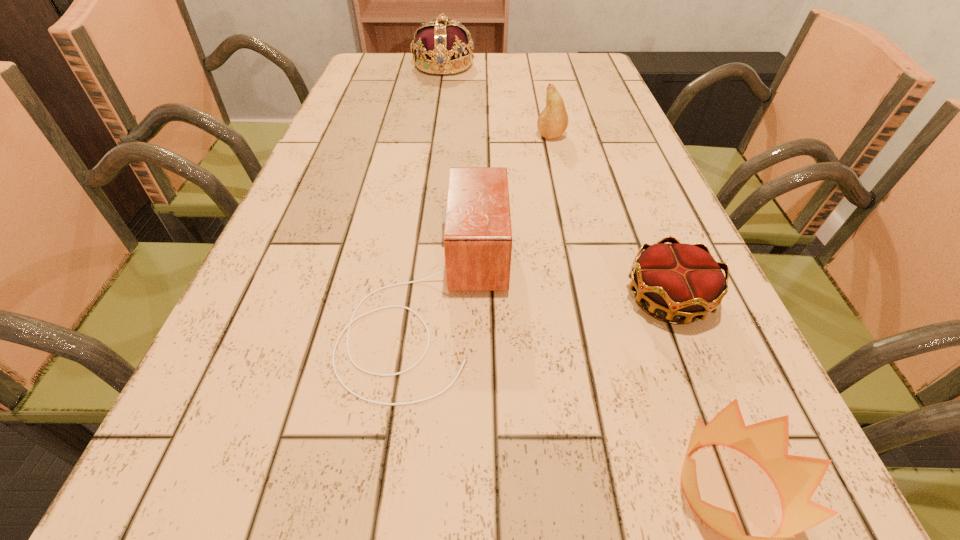
Where is `the farthest crown`? the farthest crown is located at coordinates (440, 46).

Where is `the leftmost crown`? Image resolution: width=960 pixels, height=540 pixels. the leftmost crown is located at coordinates (440, 46).

At what (x,y) coordinates should I click in order to perform the action: click on the fourth nearest object. Please return your answer as a coordinate pair (x, y). The image size is (960, 540). Looking at the image, I should click on 552,122.

Where is `the third object from right to left`? The height and width of the screenshot is (540, 960). the third object from right to left is located at coordinates (552, 122).

At what (x,y) coordinates should I click in order to perform the action: click on radio receiver. Please return your answer as a coordinate pair (x, y). The width and height of the screenshot is (960, 540). Looking at the image, I should click on [476, 222].

Locate an element on the screen. the second farthest crown is located at coordinates (683, 280).

You are a GUI agent. You are given a task and a screenshot of the screen. Output one action in this format:
    pyautogui.click(x=<x>, y=<y>)
    Task: Click on the vacant space located on the front of the tallest crown
    The height and width of the screenshot is (540, 960).
    Given the screenshot: What is the action you would take?
    pyautogui.click(x=437, y=112)

This screenshot has width=960, height=540. What are the coordinates of `vacant point located on the back of the fourth nearest object` in the screenshot? It's located at (538, 76).

This screenshot has width=960, height=540. In order to click on free point located on the front-facing side of the radio receiver in this screenshot , I will do `click(584, 295)`.

The image size is (960, 540). In order to click on vacant point located 0.220m on the front of the second nearest crown in this screenshot , I will do `click(744, 488)`.